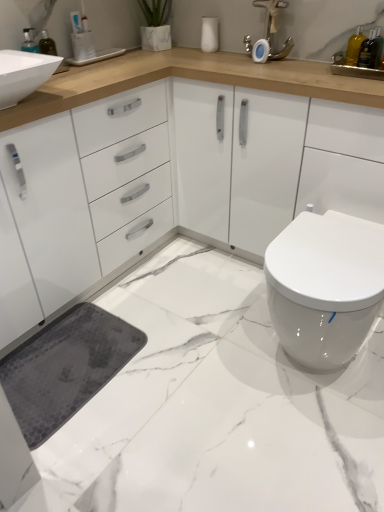
Find the location of a particular element. Image resolution: width=384 pixels, height=512 pixels. vacant area that lies between matte silver faucet at upper center and translucent glass bottle at upper right, acting as the 1th toiletry starting from the bottom is located at coordinates (315, 61).